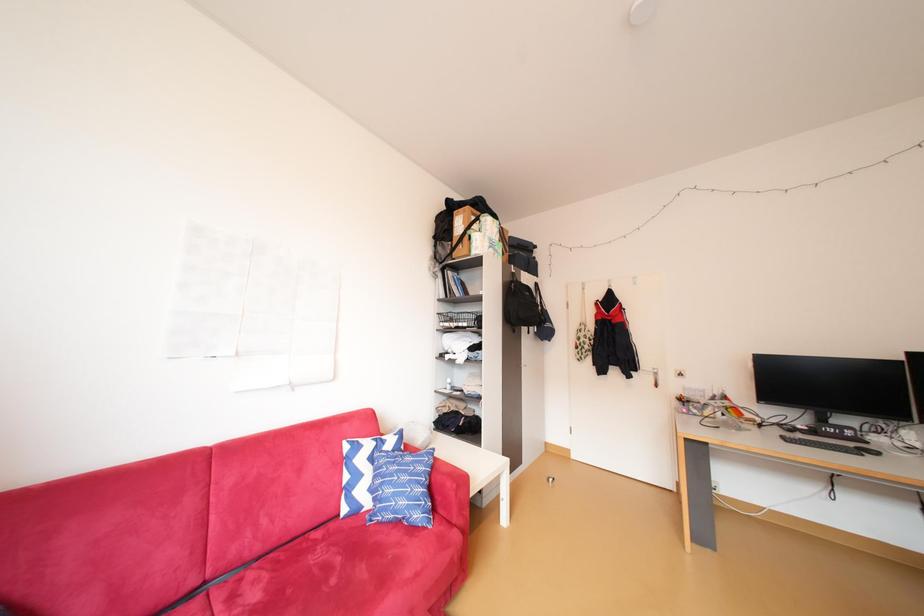
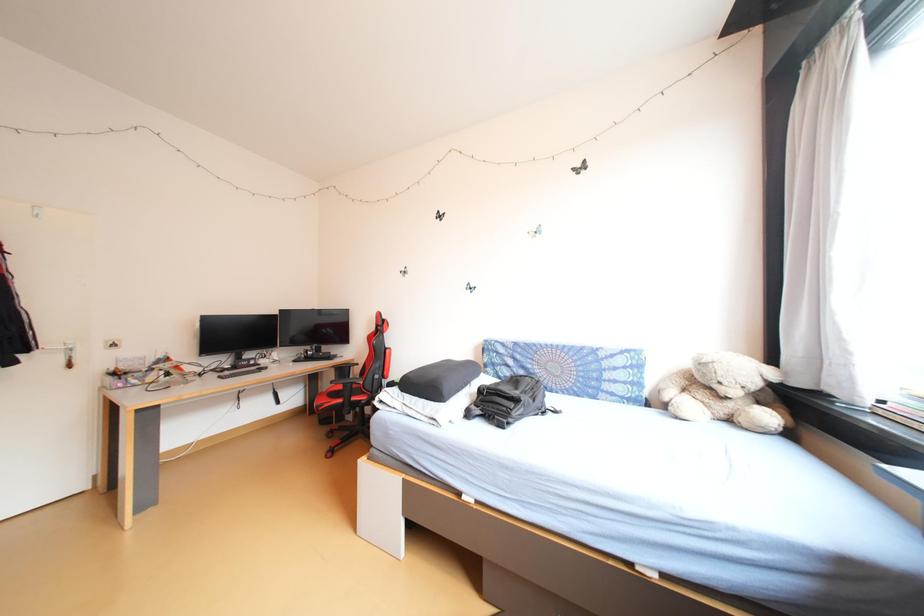
Question: The camera is either moving clockwise (left) or counter-clockwise (right) around the object. The first image is from the beginning of the video and the second image is from the end. Is the camera moving left or right when shooting the video?

Choices:
 (A) Left
 (B) Right

Answer: (A)